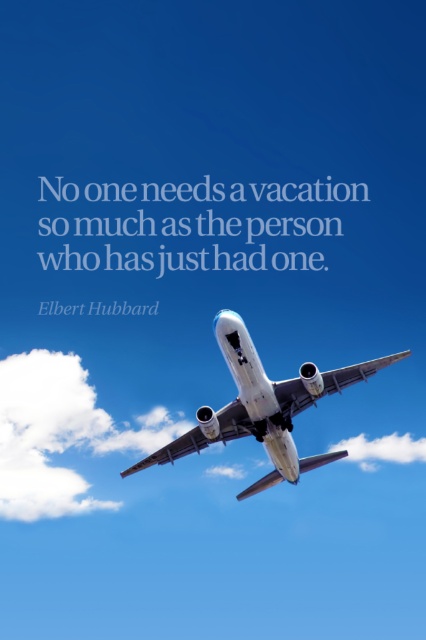
Is white fluffy cloud at lower left further to camera compared to white glossy airplane at center?

Yes, white fluffy cloud at lower left is further from the viewer.

Describe the element at coordinates (46, 435) in the screenshot. I see `white fluffy cloud at lower left` at that location.

The height and width of the screenshot is (640, 426). What do you see at coordinates (46, 435) in the screenshot?
I see `white fluffy cloud at lower left` at bounding box center [46, 435].

This screenshot has height=640, width=426. Identify the location of white fluffy cloud at lower left. (46, 435).

Is the position of white fluffy cloud at lower left more distant than that of white fluffy cloud at center?

Yes, it is behind white fluffy cloud at center.

Consider the image. Can you confirm if white fluffy cloud at lower left is taller than white fluffy cloud at center?

Yes.

What do you see at coordinates (46, 435) in the screenshot? I see `white fluffy cloud at lower left` at bounding box center [46, 435].

Locate an element on the screen. The image size is (426, 640). white fluffy cloud at lower left is located at coordinates (46, 435).

Is white glossy airplane at center to the left of white fluffy cloud at center from the viewer's perspective?

Correct, you'll find white glossy airplane at center to the left of white fluffy cloud at center.

Between white glossy airplane at center and white fluffy cloud at center, which one is positioned higher?

Positioned higher is white glossy airplane at center.

Where is `white glossy airplane at center`? Image resolution: width=426 pixels, height=640 pixels. white glossy airplane at center is located at coordinates (262, 406).